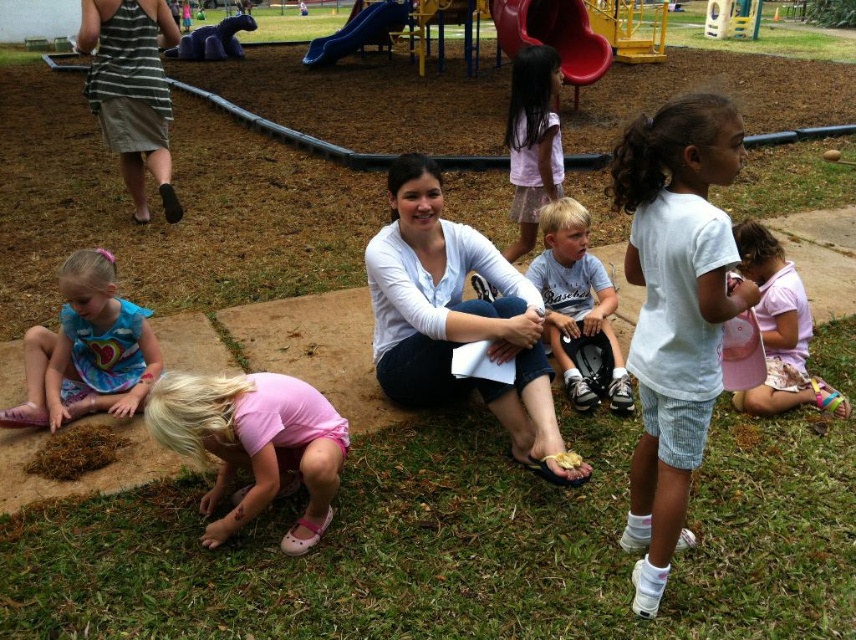
You are standing in the playground and want to find the nearest point between point A at coordinates point (128,339) and point B at coordinates point (214,44). Which point is closer to you?

Point A at coordinates point (128,339) is closer to the viewer than point B at coordinates point (214,44).

You are planning to place a 1.5 meter wide picnic blanket on the grassy area. The blue cotton dress at lower left and the purple fabric slide at upper center are in the way. Which object is wider, making it harder to place the blanket?

The purple fabric slide at upper center is wider than the blue cotton dress at lower left, so it would be the object making it harder to place the picnic blanket.